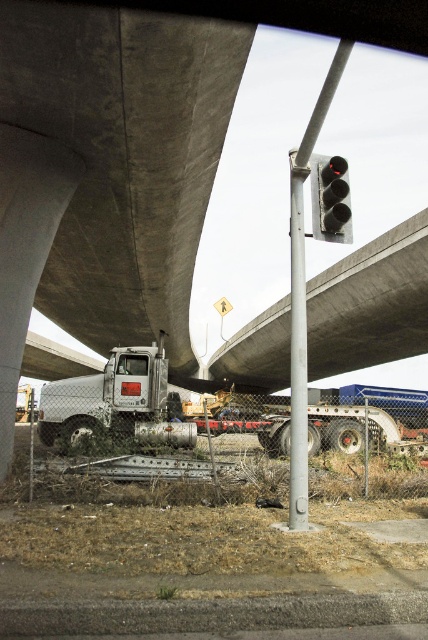
You are a city planner assessing the urban scene. You notice the silver metallic pole at center and the black matte traffic light at upper center. Which object has a smaller width?

The silver metallic pole at center has a lesser width compared to the black matte traffic light at upper center, so the silver metallic pole at center has a smaller width.

You are standing at the base of the overpass and want to reach the point marked at coordinates point (407, 346). If you walk straight ahead, will you reach the point before the traffic light pole?

The point marked at coordinates point (407, 346) is 31.02 meters from the viewer. Since the traffic light pole is in the foreground, it is closer than the point, so you would reach the traffic light pole before the point.